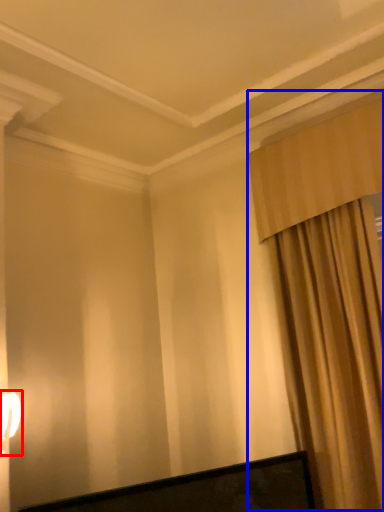
Question: Which object appears closest to the camera in this image, table lamp (highlighted by a red box) or curtain (highlighted by a blue box)?

Choices:
 (A) table lamp
 (B) curtain

Answer: (A)